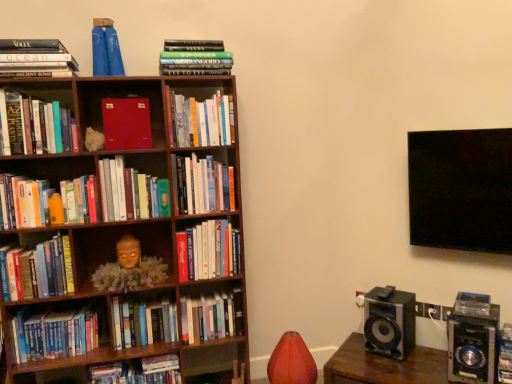
Question: Is hardcover book at center, the 5th book positioned from the right, in front of or behind matte red book at center-left, acting as the sixth book starting from the left, in the image?

Choices:
 (A) behind
 (B) front

Answer: (A)

Question: From the image's perspective, is hardcover book at center, acting as the 11th book starting from the left, located above or below matte red book at center-left, the 10th book in the right-to-left sequence?

Choices:
 (A) above
 (B) below

Answer: (A)

Question: Which object is positioned farthest from the velvet red bean bag chair at lower center?

Choices:
 (A) hardcover book at center, the 12th book from the left
 (B) hardcover book at center, the seventh book in the left-to-right sequence
 (C) hardcover book at center, which is the first book in right-to-left order
 (D) wooden bookcase at left
 (E) hardcover book at center, arranged as the 9th book when viewed from the left

Answer: (C)

Question: Which object is the farthest from the hardcover book at center, the 5th book positioned from the right?

Choices:
 (A) matte gold mask at center-left
 (B) hardcover book at left, the thirteenth book positioned from the right
 (C) hardcover book at left, placed as the fifteenth book when sorted from right to left
 (D) hardcover book at center, which is the 13th book in left-to-right order
 (E) wooden bookcase at left

Answer: (C)